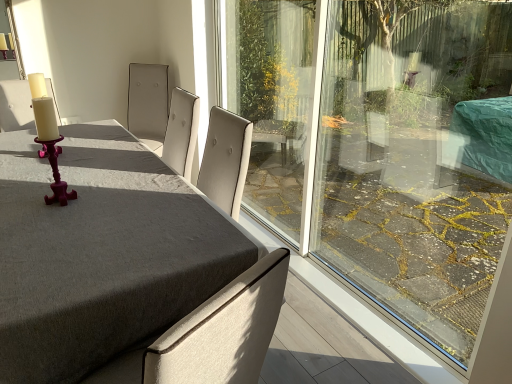
Identify the location of vacant space to the right of matte purple candlestick at left. (96, 198).